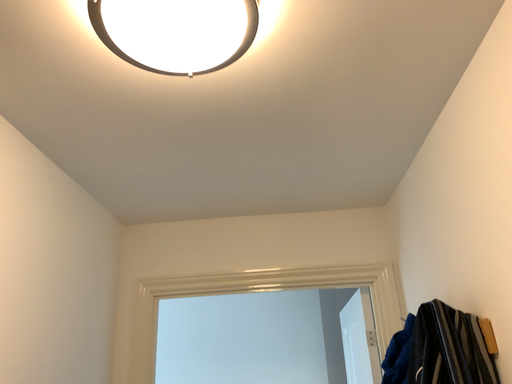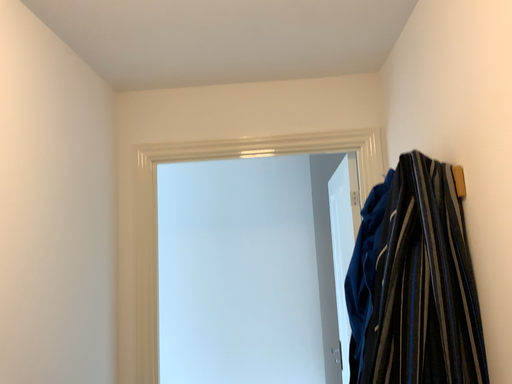
Question: Which way did the camera rotate in the video?

Choices:
 (A) rotated upward
 (B) rotated downward

Answer: (B)